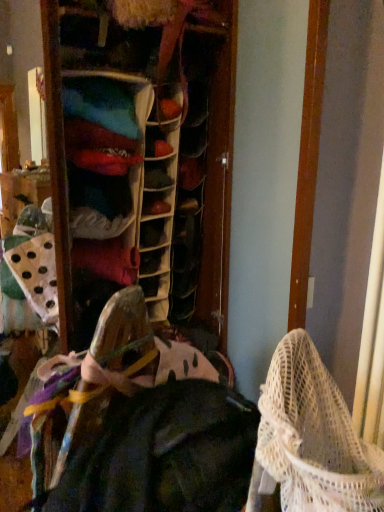
Where is `dark green fabric at center`? The image size is (384, 512). dark green fabric at center is located at coordinates (164, 454).

In order to face dark green fabric at center, should I rotate leftwards or rightwards?

Rotate left and turn 7.174 degrees.

What do you see at coordinates (164, 454) in the screenshot? This screenshot has height=512, width=384. I see `dark green fabric at center` at bounding box center [164, 454].

What do you see at coordinates (312, 438) in the screenshot?
I see `white mesh baby carriage at lower right` at bounding box center [312, 438].

Identify the location of white mesh baby carriage at lower right. This screenshot has height=512, width=384. pyautogui.click(x=312, y=438).

I want to click on dark green fabric at center, so click(x=164, y=454).

Considering the positions of objects dark green fabric at center and white mesh baby carriage at lower right in the image provided, who is more to the right, dark green fabric at center or white mesh baby carriage at lower right?

white mesh baby carriage at lower right is more to the right.

Considering the relative positions of dark green fabric at center and white mesh baby carriage at lower right in the image provided, is dark green fabric at center behind white mesh baby carriage at lower right?

Yes, dark green fabric at center is behind white mesh baby carriage at lower right.

Is point (188, 437) farther from camera compared to point (275, 400)?

Yes, it is.

From the image's perspective, which one is positioned lower, dark green fabric at center or white mesh baby carriage at lower right?

From the image's view, dark green fabric at center is below.

From a real-world perspective, is dark green fabric at center beneath white mesh baby carriage at lower right?

Yes, from a real-world perspective, dark green fabric at center is under white mesh baby carriage at lower right.

Considering the sizes of dark green fabric at center and white mesh baby carriage at lower right in the image, is dark green fabric at center wider or thinner than white mesh baby carriage at lower right?

In the image, dark green fabric at center appears to be wider than white mesh baby carriage at lower right.

Who is taller, dark green fabric at center or white mesh baby carriage at lower right?

dark green fabric at center.

Does dark green fabric at center have a larger size compared to white mesh baby carriage at lower right?

Yes, dark green fabric at center is bigger than white mesh baby carriage at lower right.

Would you say dark green fabric at center contains white mesh baby carriage at lower right?

No, white mesh baby carriage at lower right is not inside dark green fabric at center.

Is dark green fabric at center not close to white mesh baby carriage at lower right?

No.

Is dark green fabric at center turned away from white mesh baby carriage at lower right?

No, dark green fabric at center is not facing the opposite direction of white mesh baby carriage at lower right.

How different are the orientations of dark green fabric at center and white mesh baby carriage at lower right in degrees?

dark green fabric at center and white mesh baby carriage at lower right are facing 24.3 degrees away from each other.

Identify the location of baby carriage lying above the dark green fabric at center (from the image's perspective). This screenshot has height=512, width=384. (312, 438).

Considering the positions of objects white mesh baby carriage at lower right and dark green fabric at center in the image provided, who is more to the right, white mesh baby carriage at lower right or dark green fabric at center?

From the viewer's perspective, white mesh baby carriage at lower right appears more on the right side.

Which is in front, white mesh baby carriage at lower right or dark green fabric at center?

white mesh baby carriage at lower right.

Which point is more forward, (307, 439) or (132, 492)?

The point (307, 439) is closer to the camera.

From the image's perspective, between white mesh baby carriage at lower right and dark green fabric at center, who is located below?

dark green fabric at center is shown below in the image.

From a real-world perspective, is white mesh baby carriage at lower right located higher than dark green fabric at center?

Indeed, from a real-world perspective, white mesh baby carriage at lower right stands above dark green fabric at center.

Looking at their sizes, would you say white mesh baby carriage at lower right is wider or thinner than dark green fabric at center?

Considering their sizes, white mesh baby carriage at lower right looks slimmer than dark green fabric at center.

Is white mesh baby carriage at lower right shorter than dark green fabric at center?

Correct, white mesh baby carriage at lower right is not as tall as dark green fabric at center.

Between white mesh baby carriage at lower right and dark green fabric at center, which one has smaller size?

white mesh baby carriage at lower right.

Would you say dark green fabric at center is part of white mesh baby carriage at lower right's contents?

No, dark green fabric at center is not a part of white mesh baby carriage at lower right.

Is white mesh baby carriage at lower right positioned far away from dark green fabric at center?

No, there isn't a large distance between white mesh baby carriage at lower right and dark green fabric at center.

Could you tell me if white mesh baby carriage at lower right is turned towards dark green fabric at center?

Yes, white mesh baby carriage at lower right is turned towards dark green fabric at center.

Locate an element on the screen. baby carriage above the dark green fabric at center (from a real-world perspective) is located at coordinates (312, 438).

At what (x,y) coordinates should I click in order to perform the action: click on clothing on the left of white mesh baby carriage at lower right. Please return your answer as a coordinate pair (x, y). The width and height of the screenshot is (384, 512). Looking at the image, I should click on (164, 454).

The width and height of the screenshot is (384, 512). I want to click on baby carriage in front of the dark green fabric at center, so click(x=312, y=438).